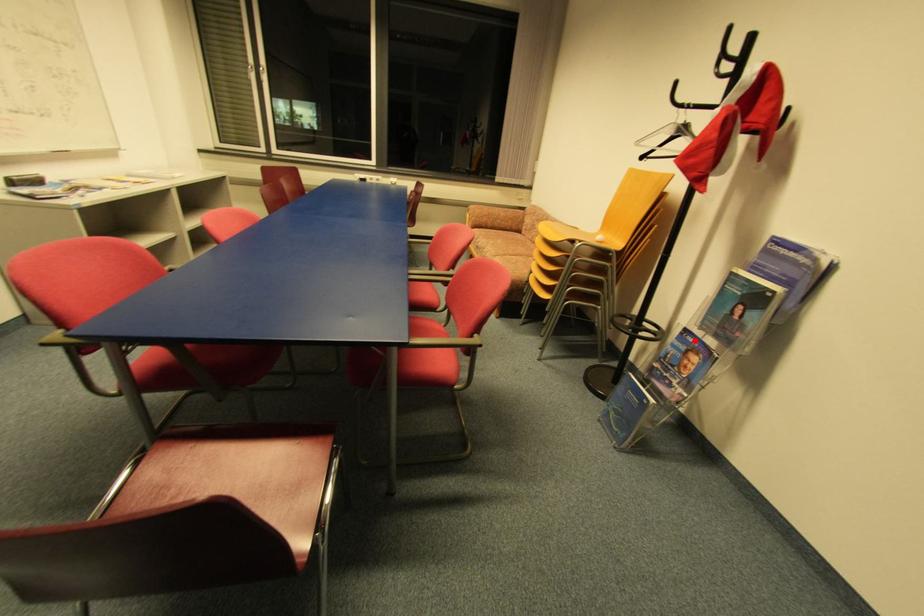
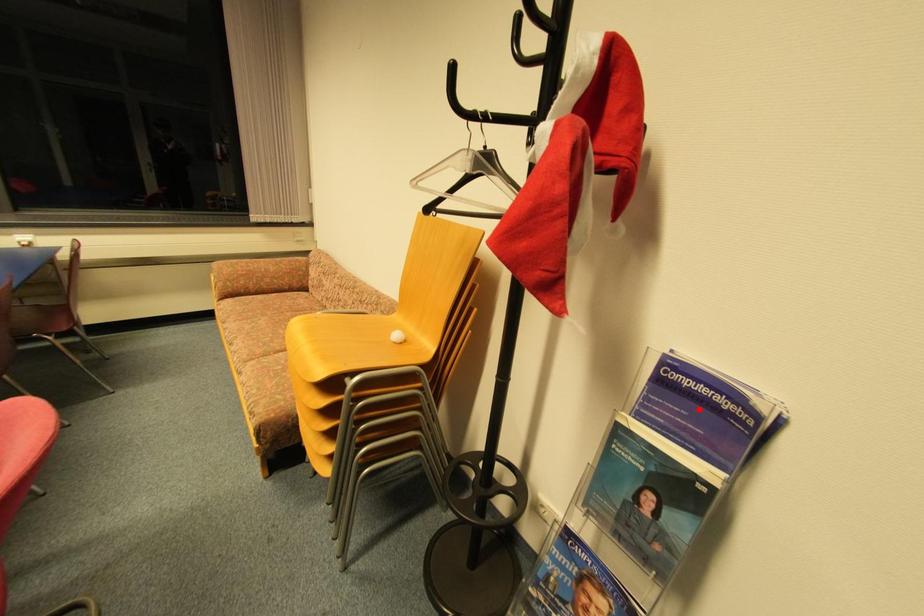
I am providing you with two images of the same scene from different viewpoints. A red point is marked on the first image and another point is marked on the second image. Is the red point in image1 aligned with the point shown in image2?

No